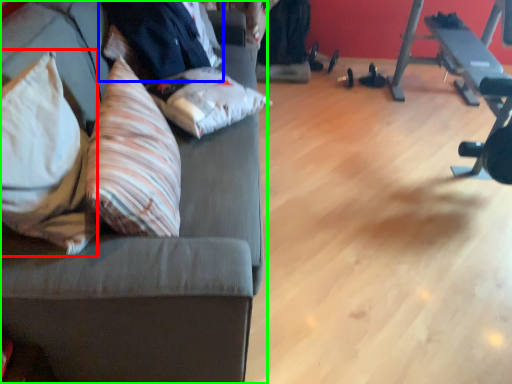
Question: Which is nearer to the throw pillow (highlighted by a red box)? businessman (highlighted by a blue box) or studio couch (highlighted by a green box).

Choices:
 (A) businessman
 (B) studio couch

Answer: (B)